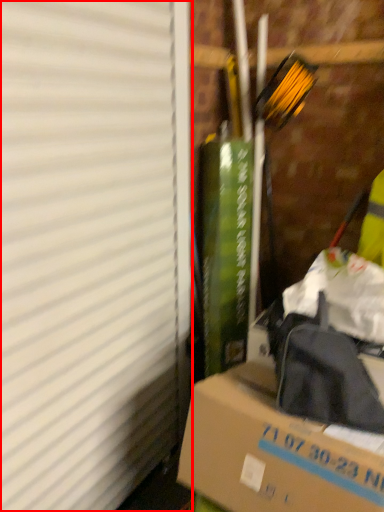
Question: Where is window screen (annotated by the red box) located in relation to box in the image?

Choices:
 (A) right
 (B) left

Answer: (B)